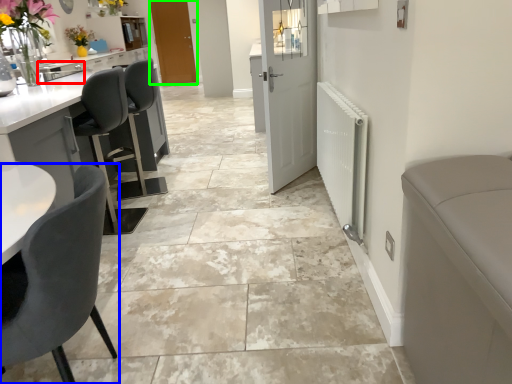
Question: Which is farther away from sink (highlighted by a red box)? chair (highlighted by a blue box) or door (highlighted by a green box)?

Choices:
 (A) chair
 (B) door

Answer: (A)